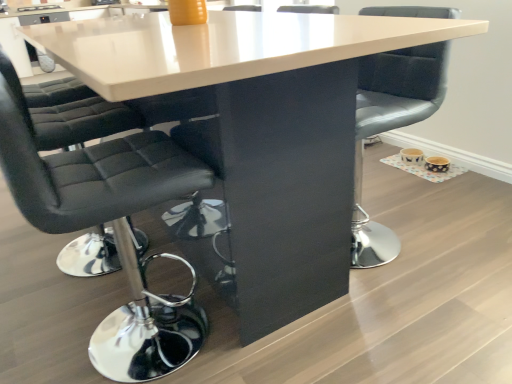
Image resolution: width=512 pixels, height=384 pixels. I want to click on free spot behind black leather chair at left, positioned as the 2th chair in right-to-left order, so click(x=139, y=274).